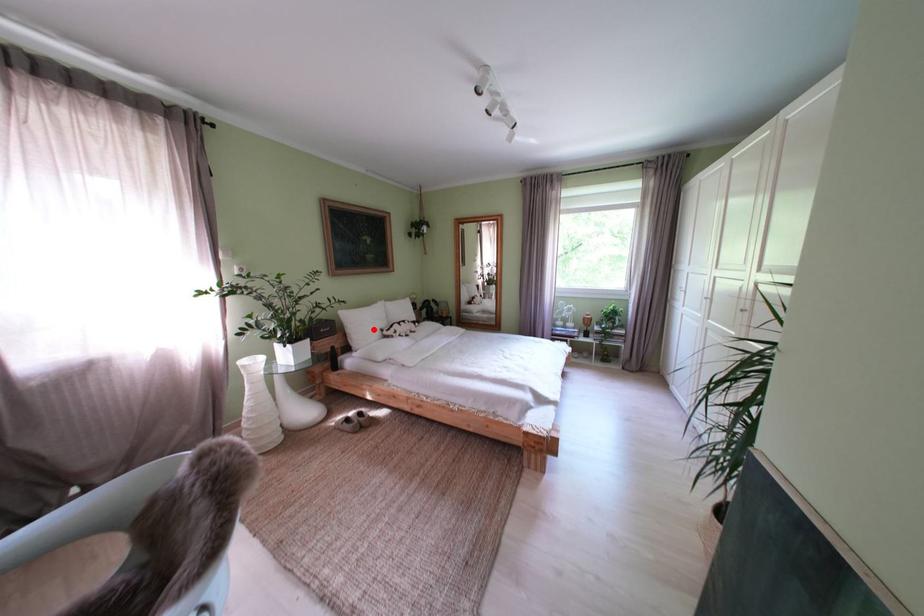
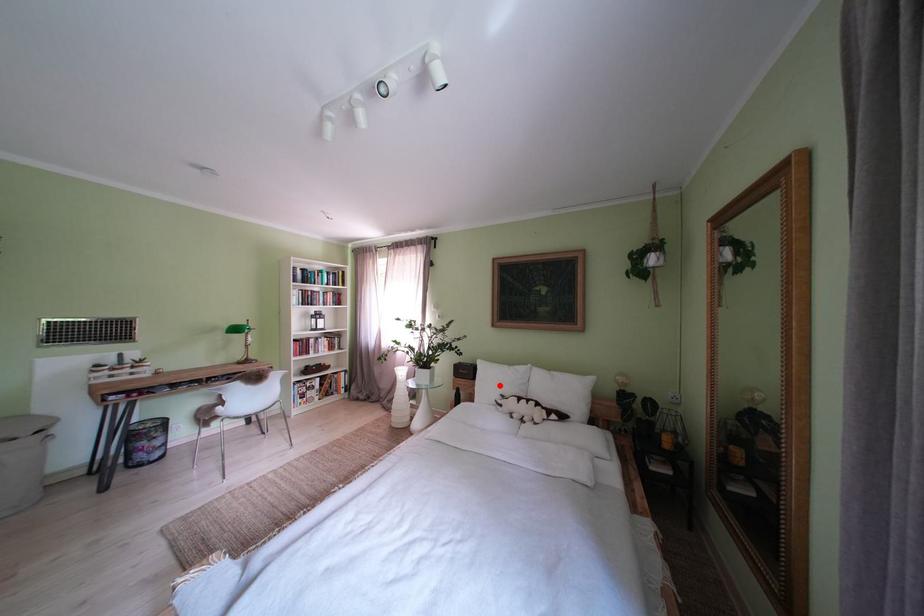
I am providing you with two images of the same scene from different viewpoints. A red point is marked on the first image and another point is marked on the second image. Are the points marked in image1 and image2 representing the same 3D position?

Yes